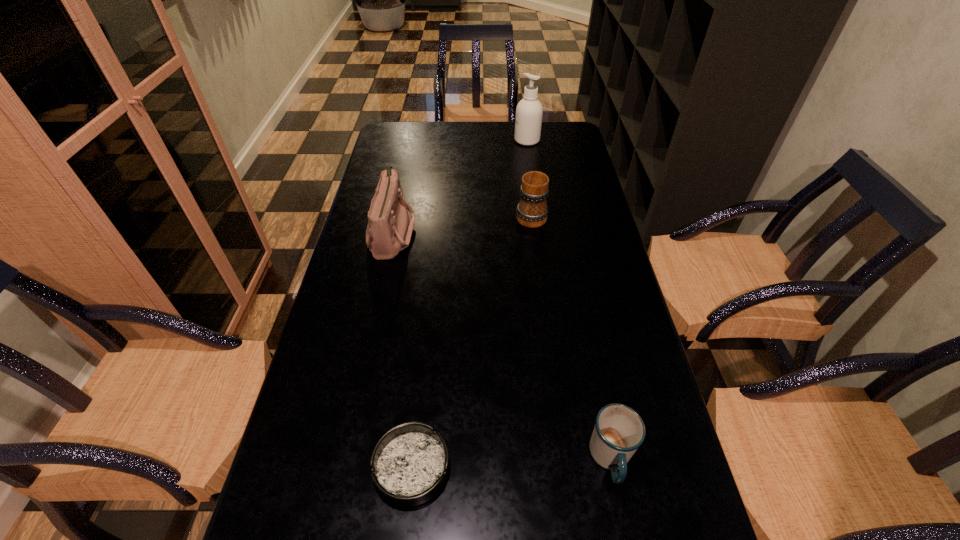
Identify the location of blank region between the fourth tallest object and the left mug. (571, 336).

At what (x,y) coordinates should I click in order to perform the action: click on vacant area between the shorter mug and the cleansing agent. Please return your answer as a coordinate pair (x, y). The image size is (960, 540). Looking at the image, I should click on (569, 299).

This screenshot has width=960, height=540. Find the location of `vacant space that's between the shoulder bag and the shortest object`. vacant space that's between the shoulder bag and the shortest object is located at coordinates [402, 350].

The image size is (960, 540). In order to click on free point between the second shortest object and the ashtray in this screenshot , I will do `click(512, 463)`.

Where is `vacant space that's between the shortest object and the shoulder bag`? vacant space that's between the shortest object and the shoulder bag is located at coordinates (402, 350).

You are a GUI agent. You are given a task and a screenshot of the screen. Output one action in this format:
    pyautogui.click(x=<x>, y=<y>)
    Task: Click on the vacant area between the tallest object and the ashtray
    
    Given the screenshot: What is the action you would take?
    pyautogui.click(x=469, y=303)

Identify which object is the closest to the second shortest object. Please provide its 2D coordinates. Your answer should be formatted as a tuple, i.e. [(x, y)], where the tuple contains the x and y coordinates of a point satisfying the conditions above.

[(410, 464)]

This screenshot has height=540, width=960. I want to click on object that stands as the second closest to the taller mug, so click(x=529, y=111).

Locate an element on the screen. free space that satisfies the following two spatial constraints: 1. on the back side of the ashtray; 2. on the front pocket of the shoulder bag is located at coordinates (437, 233).

The height and width of the screenshot is (540, 960). Identify the location of free location that satisfies the following two spatial constraints: 1. on the back side of the ashtray; 2. on the front pocket of the shoulder bag. (437, 233).